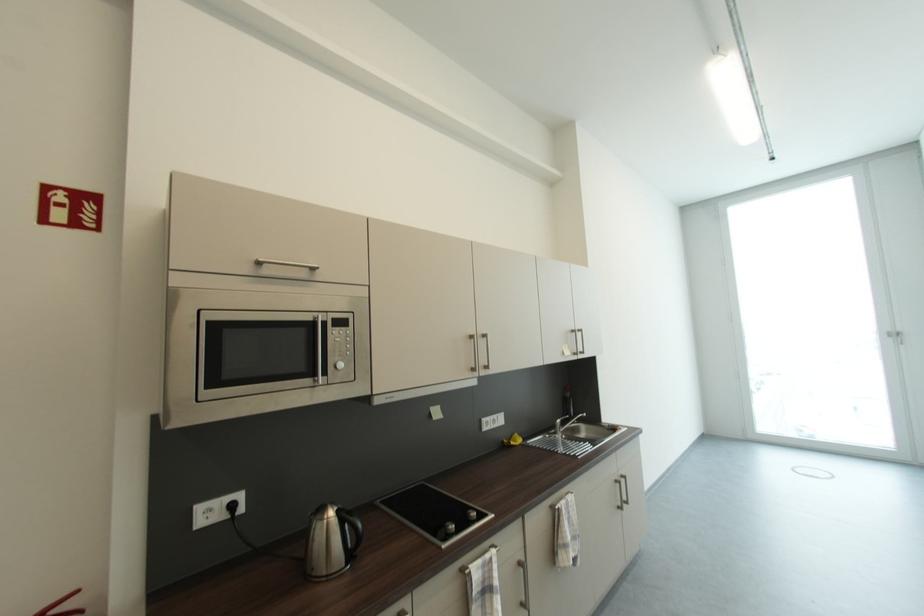
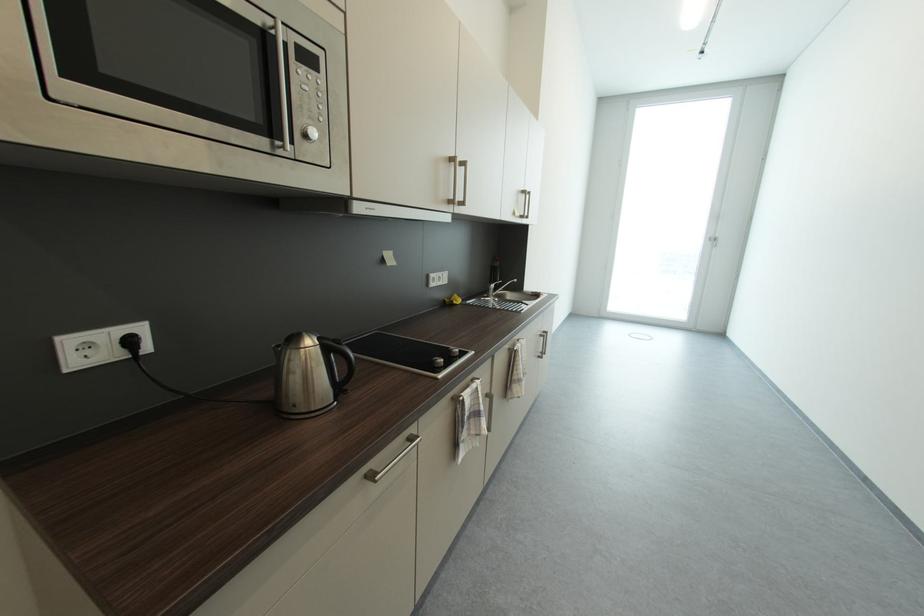
Locate, in the second image, the point that corresponds to the point at 565,511 in the first image.

(523, 351)